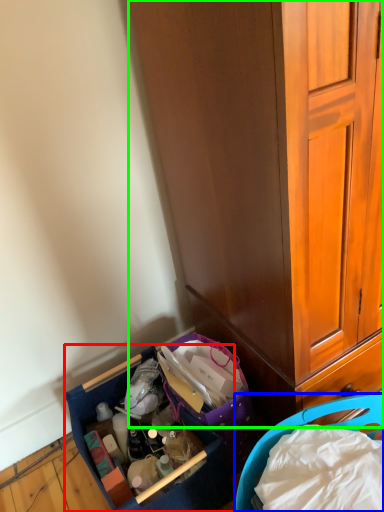
Question: Which is farther away from picnic basket (highlighted by a red box)? picnic basket (highlighted by a blue box) or cabinetry (highlighted by a green box)?

Choices:
 (A) picnic basket
 (B) cabinetry

Answer: (B)